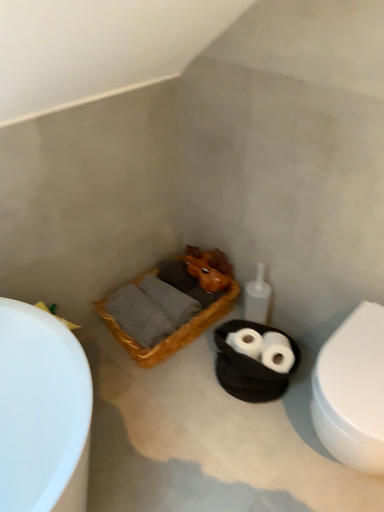
This screenshot has height=512, width=384. Find the location of `vacant area to the right of white glossy bathtub at left`. vacant area to the right of white glossy bathtub at left is located at coordinates (122, 395).